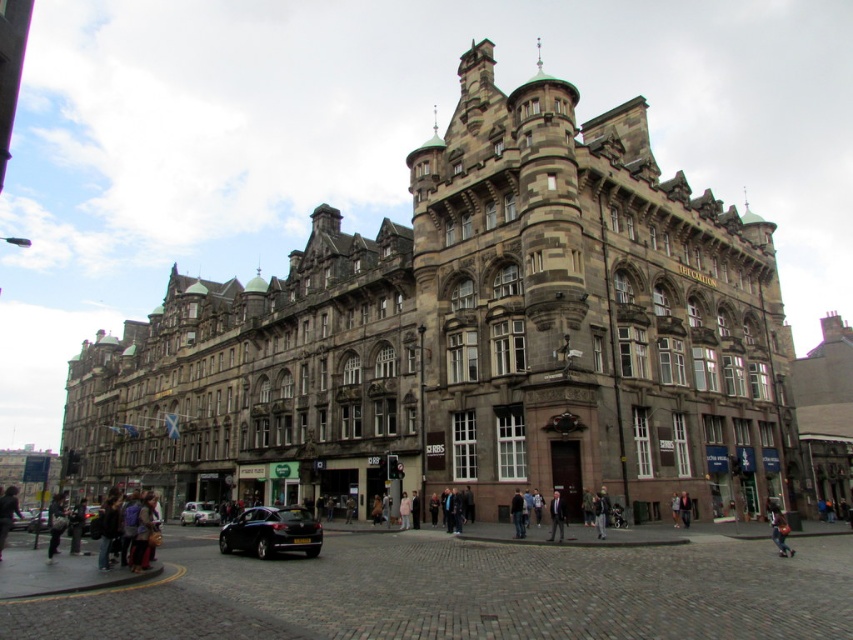
Based on the photo, you are a photographer standing on the cobblestone street in front of the historic building. You notice a light blue denim jacket at lower right and a dark brown leather jacket at center. Which jacket is closer to you?

The light blue denim jacket at lower right is closer because it is positioned over the dark brown leather jacket at center, indicating it is in front.

You are a photographer planning to capture the historic building in the background. You want to ensure both the shiny black car at lower left and the light blue denim jacket at lower right are visible in the frame. Given their sizes, which object might require you to adjust your camera angle to include it properly?

The shiny black car at lower left is larger in size than the light blue denim jacket at lower right, so you might need to adjust your camera angle to ensure the larger shiny black car at lower left fits into the frame properly.